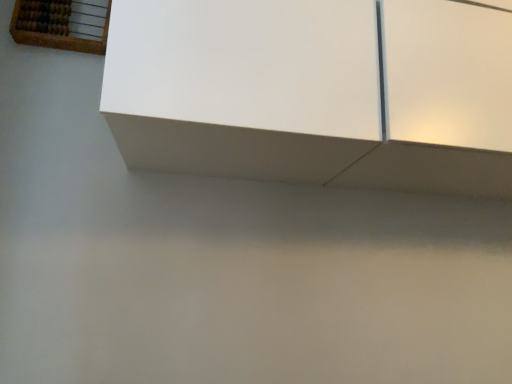
What do you see at coordinates (59, 36) in the screenshot?
I see `wooden abacus at upper left` at bounding box center [59, 36].

Where is `wooden abacus at upper left`? This screenshot has width=512, height=384. wooden abacus at upper left is located at coordinates (59, 36).

Where is `wooden abacus at upper left`? The height and width of the screenshot is (384, 512). wooden abacus at upper left is located at coordinates (59, 36).